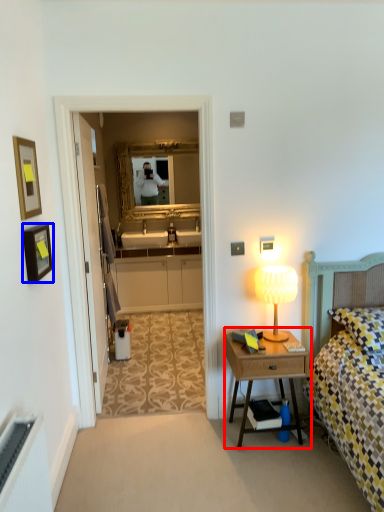
Question: Among these objects, which one is farthest to the camera, nightstand (highlighted by a red box) or picture frame (highlighted by a blue box)?

Choices:
 (A) nightstand
 (B) picture frame

Answer: (A)